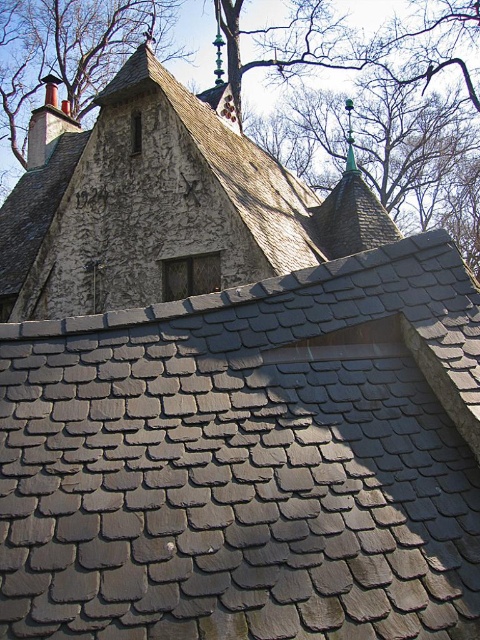
Which is below, dark gray slate tile roof at upper center or green slate chimney at upper left?

dark gray slate tile roof at upper center is lower down.

Can you confirm if dark gray slate tile roof at upper center is positioned below green slate chimney at upper left?

Yes, dark gray slate tile roof at upper center is below green slate chimney at upper left.

Describe the element at coordinates (250, 460) in the screenshot. The image size is (480, 640). I see `dark gray slate tile roof at upper center` at that location.

At what (x,y) coordinates should I click in order to perform the action: click on dark gray slate tile roof at upper center. Please return your answer as a coordinate pair (x, y). The height and width of the screenshot is (640, 480). Looking at the image, I should click on (250, 460).

What are the coordinates of `green textured roof at upper center` in the screenshot? It's located at (71, 51).

Does point (159, 35) come behind point (41, 108)?

Yes.

The image size is (480, 640). What are the coordinates of `green textured roof at upper center` in the screenshot? It's located at (71, 51).

Is dark gray slate tile roof at upper center below gray slate roof at upper center?

Correct, dark gray slate tile roof at upper center is located below gray slate roof at upper center.

Between dark gray slate tile roof at upper center and gray slate roof at upper center, which one is positioned lower?

dark gray slate tile roof at upper center is lower down.

Who is more forward, (58,557) or (141,67)?

Point (58,557) is in front.

I want to click on dark gray slate tile roof at upper center, so click(x=250, y=460).